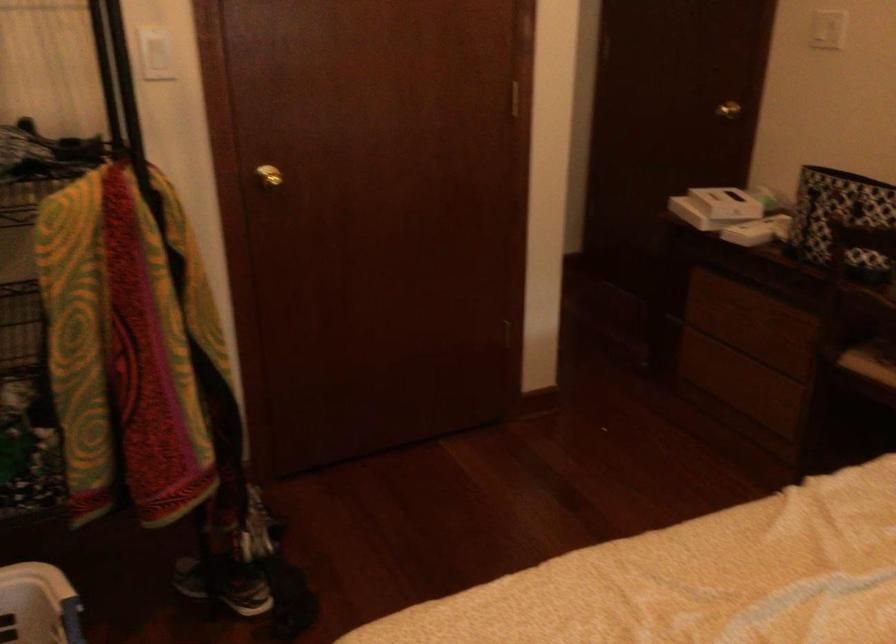
The height and width of the screenshot is (644, 896). I want to click on basket handle, so click(x=63, y=616).